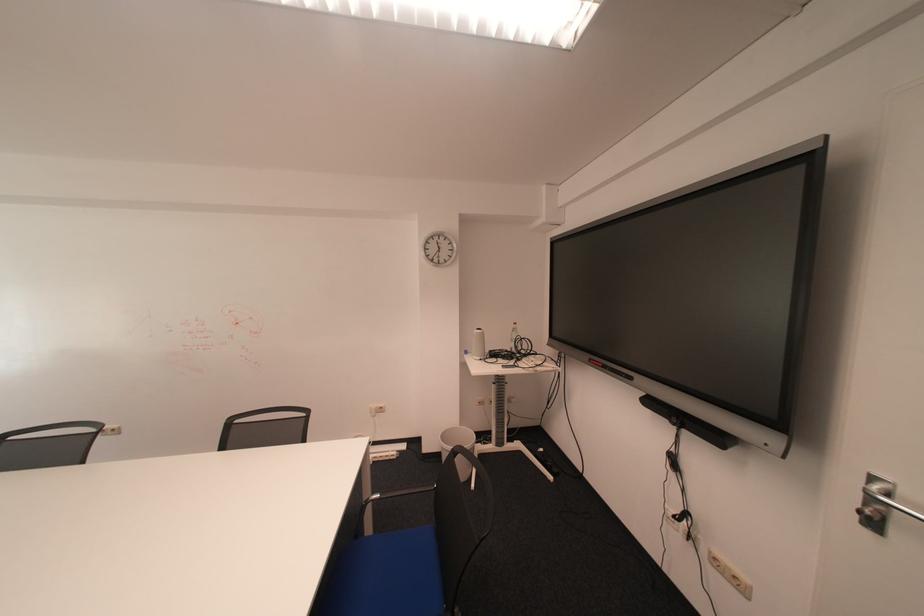
What do you see at coordinates (390, 576) in the screenshot?
I see `the blue chair sitting surface` at bounding box center [390, 576].